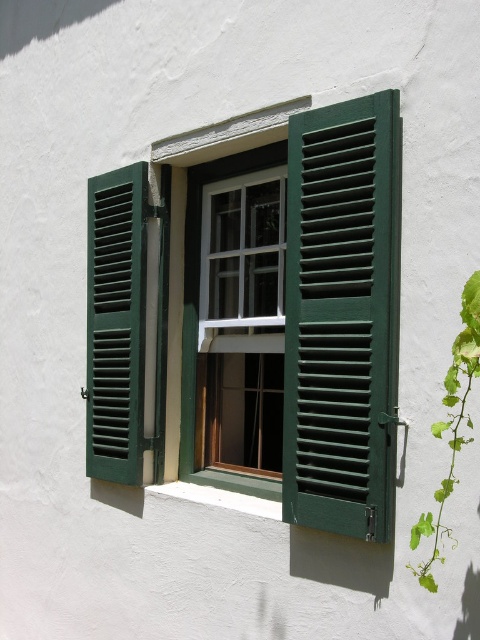
Describe the element at coordinates (342, 316) in the screenshot. I see `green painted wood shutter at center` at that location.

From the picture: Who is more distant from viewer, (383,349) or (108,468)?

The point (108,468) is behind.

Does point (314, 356) lie behind point (120, 307)?

No, (314, 356) is in front of (120, 307).

This screenshot has width=480, height=640. Identify the location of green painted wood shutter at center. (342, 316).

Is point (448, 396) positioned behind point (180, 486)?

No, it is in front of (180, 486).

Between green leafy vine at right and white concrete at lower center, which one appears on the right side from the viewer's perspective?

From the viewer's perspective, green leafy vine at right appears more on the right side.

In order to click on green leafy vine at right in this screenshot , I will do `click(452, 428)`.

Which of these two, green painted wood shutters at left or green leafy vine at right, stands shorter?

With less height is green leafy vine at right.

Describe the element at coordinates (116, 323) in the screenshot. I see `green painted wood shutters at left` at that location.

Is point (106, 246) farther from viewer compared to point (454, 392)?

That is True.

Where is `green painted wood shutters at left`? This screenshot has height=640, width=480. green painted wood shutters at left is located at coordinates (116, 323).